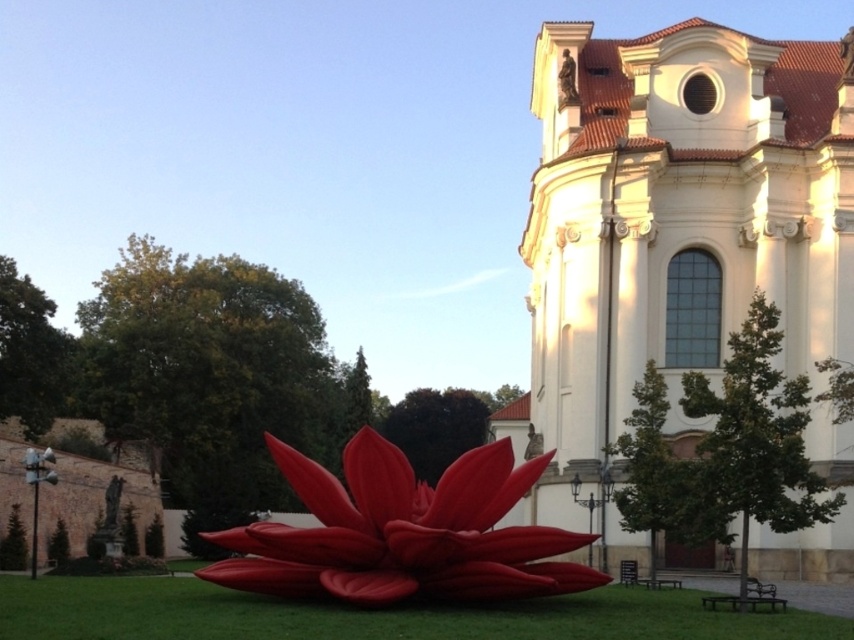
Question: Can you confirm if white smooth church at upper right is smaller than matte red flower at center?

Choices:
 (A) yes
 (B) no

Answer: (B)

Question: Which point is closer to the camera?

Choices:
 (A) green grass at lower center
 (B) white smooth church at upper right
 (C) matte red flower at center

Answer: (A)

Question: Is white smooth church at upper right above green grass at lower center?

Choices:
 (A) yes
 (B) no

Answer: (A)

Question: Does white smooth church at upper right come behind green grass at lower center?

Choices:
 (A) yes
 (B) no

Answer: (A)

Question: Among these points, which one is farthest from the camera?

Choices:
 (A) (645, 621)
 (B) (576, 289)

Answer: (B)

Question: Estimate the real-world distances between objects in this image. Which object is farther from the matte red flower at center?

Choices:
 (A) green grass at lower center
 (B) white smooth church at upper right

Answer: (B)